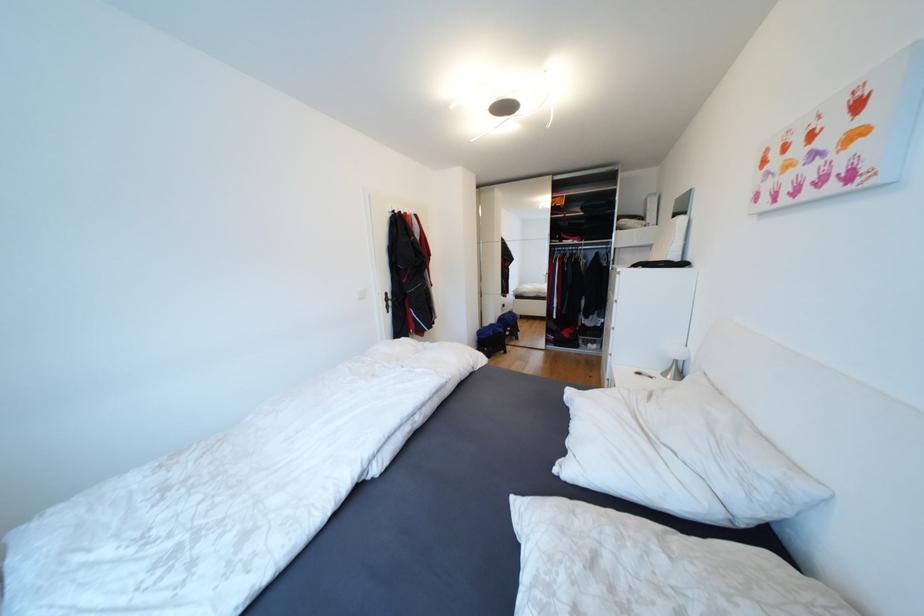
Find the location of a particular element. This screenshot has height=616, width=924. small table lamp is located at coordinates (675, 361).